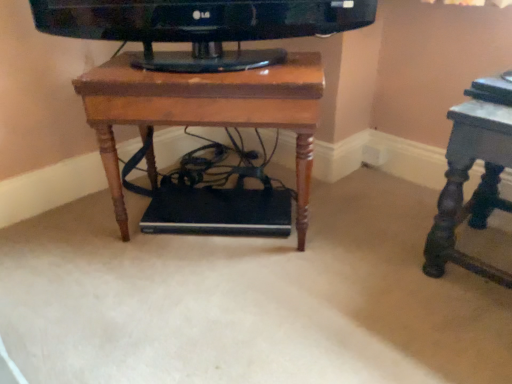
Find the location of a particular element. This screenshot has width=512, height=384. vacant space in front of wooden table at center, arranged as the 2th table when viewed from the right is located at coordinates [x=212, y=304].